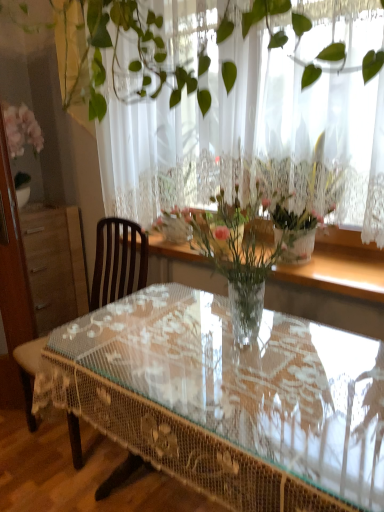
Locate an element on the screen. The image size is (384, 512). vacant space that is to the left of clear glass vase at center is located at coordinates (125, 340).